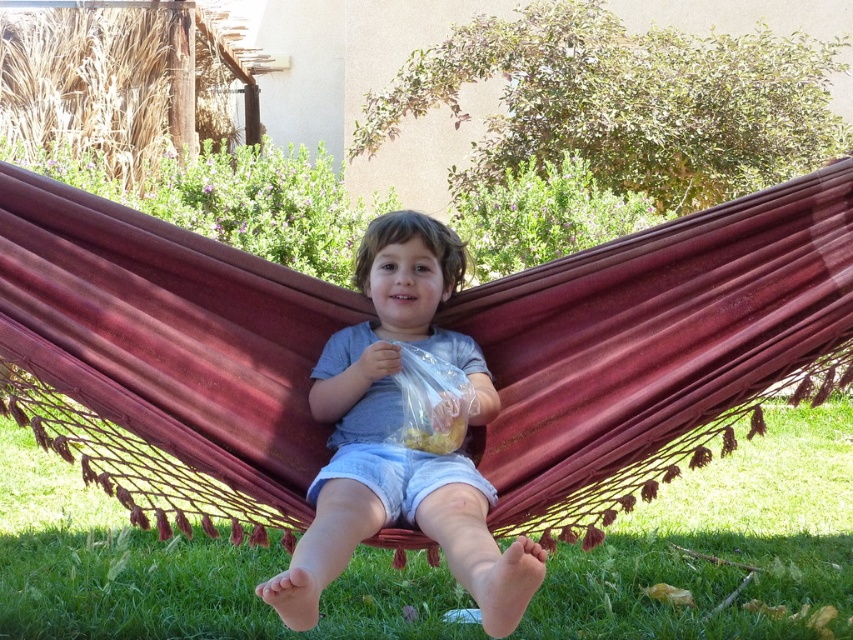
Question: Which object is farther from the camera taking this photo?

Choices:
 (A) matte gray shirt at center
 (B) burgundy fabric hammock at center

Answer: (B)

Question: Does burgundy fabric hammock at center lie behind matte gray shirt at center?

Choices:
 (A) no
 (B) yes

Answer: (B)

Question: Is burgundy fabric hammock at center wider than matte gray shirt at center?

Choices:
 (A) no
 (B) yes

Answer: (B)

Question: Which of the following is the closest to the observer?

Choices:
 (A) (601, 467)
 (B) (316, 387)

Answer: (A)

Question: Does burgundy fabric hammock at center lie in front of matte gray shirt at center?

Choices:
 (A) no
 (B) yes

Answer: (A)